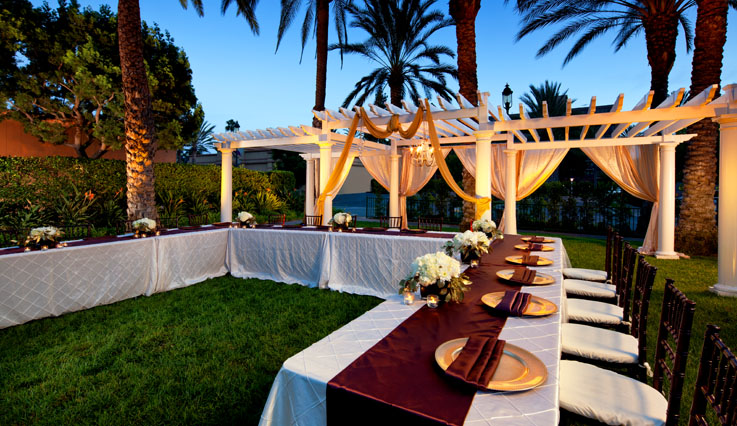
This screenshot has height=426, width=737. Find the location of `gold plates`. gold plates is located at coordinates (509, 371), (536, 306), (539, 277), (542, 259), (544, 245), (548, 237).